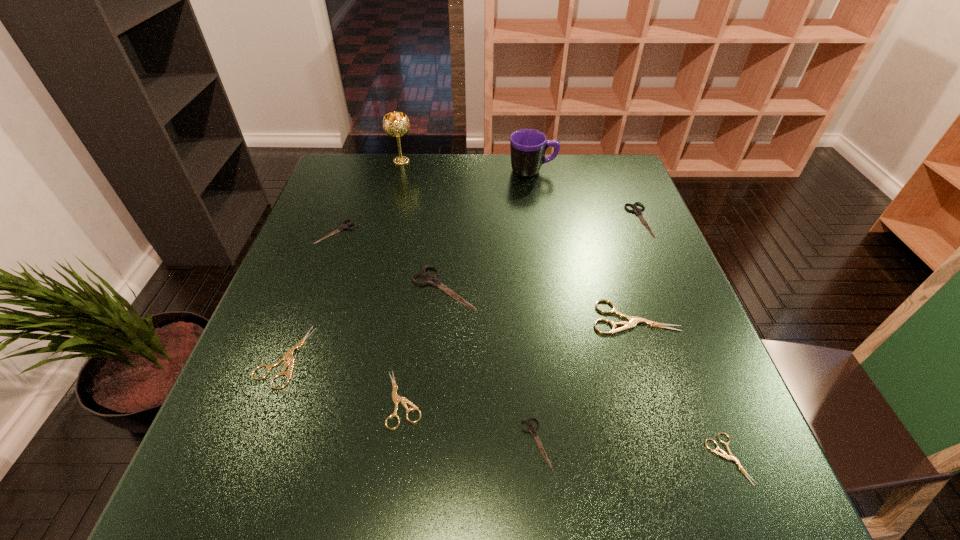
Where is `the third beige shears from right to left`? the third beige shears from right to left is located at coordinates (397, 399).

Identify the location of the second black shears from right to left. This screenshot has width=960, height=540. (531, 429).

Locate an element on the screen. The image size is (960, 540). the nearest black shears is located at coordinates (531, 429).

The width and height of the screenshot is (960, 540). I want to click on the nearest beige shears, so click(724, 455).

Locate an element on the screen. the shortest shears is located at coordinates (724, 455).

Locate an element on the screen. free location located 0.340m on the right of the tallest object is located at coordinates (521, 161).

Locate an element on the screen. The image size is (960, 540). vacant space situated 0.090m with the handle on the side of the black mug is located at coordinates (586, 171).

Locate an element on the screen. The image size is (960, 540). free region located on the right of the second nearest black shears is located at coordinates (604, 288).

Identify the location of vacant space situated 0.070m on the front of the rightmost black shears. This screenshot has height=540, width=960. (656, 258).

Where is `free space located on the back of the biggest beige shears`? The width and height of the screenshot is (960, 540). free space located on the back of the biggest beige shears is located at coordinates (619, 270).